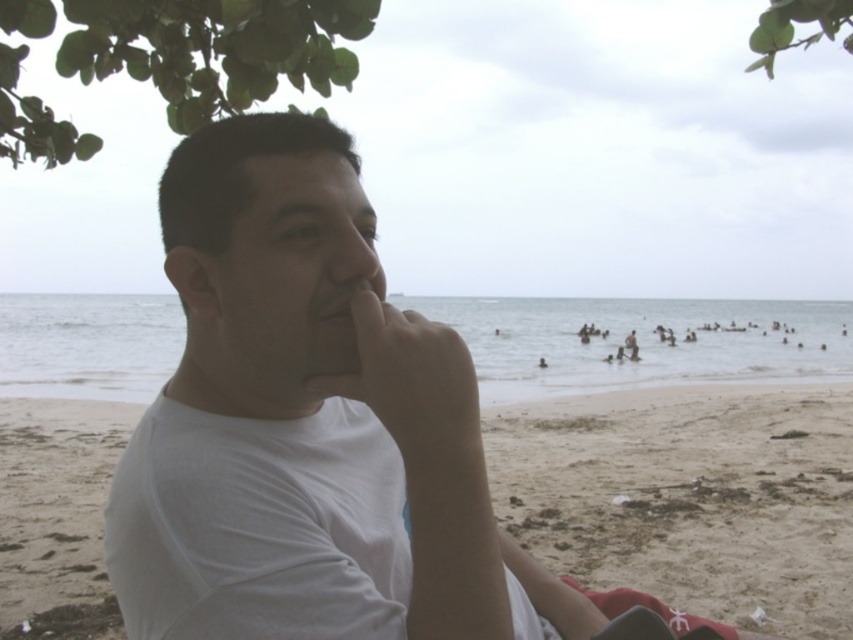
You are a photographer trying to capture the man under the tree. You need to ensure the white fabric at center and the green leafy tree at upper right are both in frame. Which object should you focus on first to make sure both are visible?

The white fabric at center is not as tall as the green leafy tree at upper right, so you should focus on the green leafy tree at upper right first to ensure both are in frame.